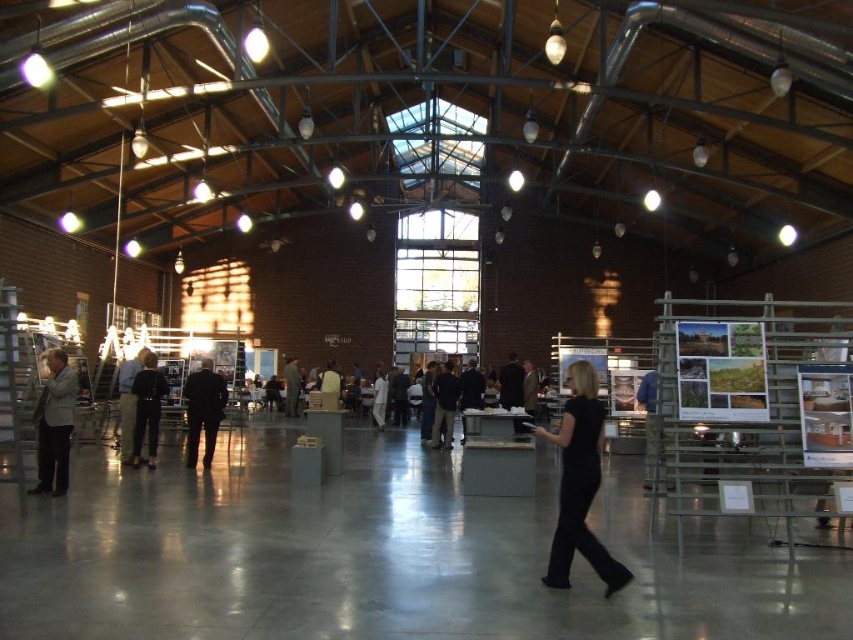
Question: Is black suit at center smaller than black leather jacket at center?

Choices:
 (A) yes
 (B) no

Answer: (A)

Question: Does black matte dress at center come in front of black leather jacket at center?

Choices:
 (A) yes
 (B) no

Answer: (A)

Question: Which point is closer to the camera taking this photo?

Choices:
 (A) (572, 477)
 (B) (213, 385)

Answer: (A)

Question: Based on their relative distances, which object is nearer to the dark gray suit at center?

Choices:
 (A) black leather jacket at center
 (B) light beige suit at left
 (C) black matte dress at center

Answer: (B)

Question: Does black matte dress at center have a smaller size compared to black fabric jacket at center?

Choices:
 (A) yes
 (B) no

Answer: (B)

Question: Which object is farther from the camera taking this photo?

Choices:
 (A) dark gray suit at center
 (B) light beige suit at left
 (C) black matte dress at center
 (D) black fabric jacket at center

Answer: (A)